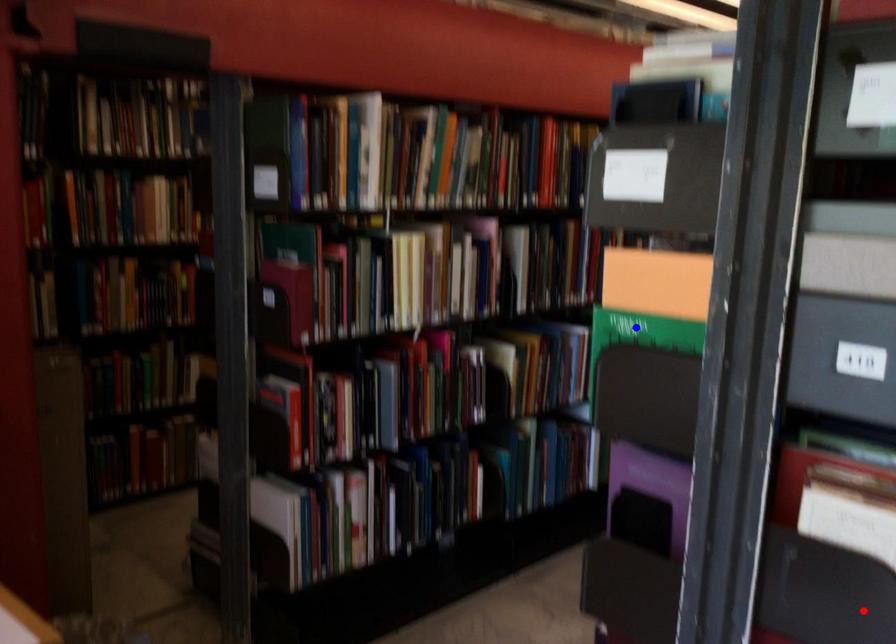
Question: Two points are marked on the image. Which point is closer to the camera?

Choices:
 (A) Blue point is closer.
 (B) Red point is closer.

Answer: (B)